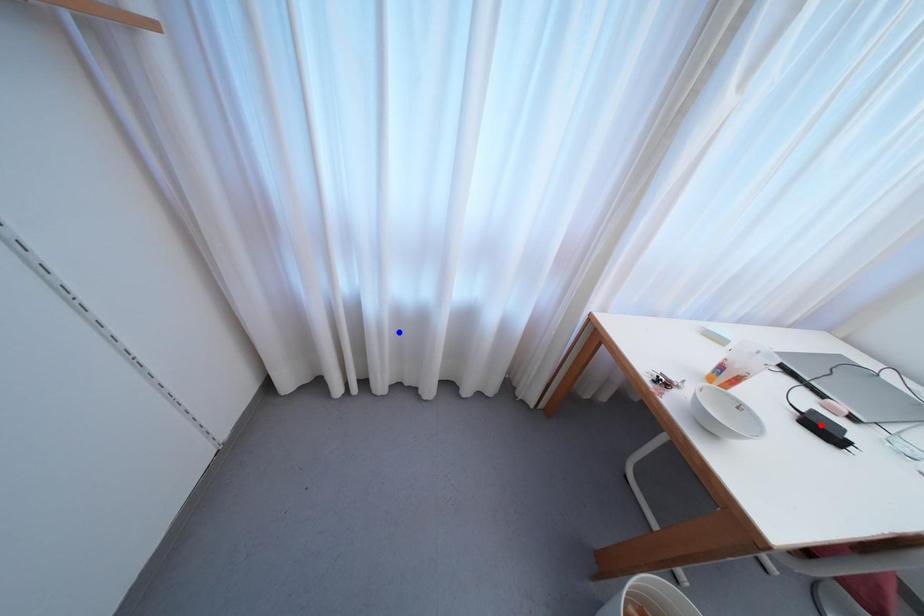
Question: In the image, two points are highlighted. Which point is nearer to the camera? Reply with the corresponding letter.

Choices:
 (A) blue point
 (B) red point

Answer: (B)